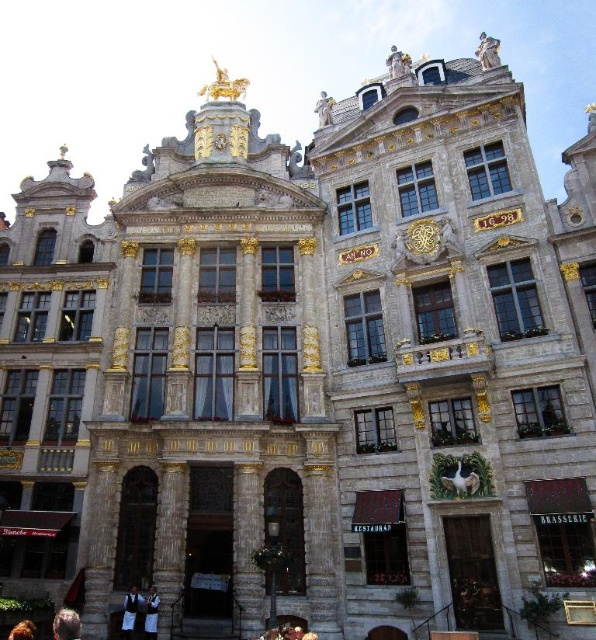
Is gold ornate clock at center closer to camera compared to brown leather jacket at lower left?

No, gold ornate clock at center is further to the viewer.

Who is lower down, gold ornate clock at center or brown leather jacket at lower left?

Positioned lower is brown leather jacket at lower left.

Which is behind, point (408, 232) or point (66, 632)?

The point (408, 232) is more distant.

Find the location of a particular element. The height and width of the screenshot is (640, 596). gold ornate clock at center is located at coordinates (423, 240).

Identify the location of brown leather jacket at lower left. (66, 625).

Can you confirm if brown leather jacket at lower left is shorter than blonde hair at lower left?

In fact, brown leather jacket at lower left may be taller than blonde hair at lower left.

Where is `brown leather jacket at lower left`? The height and width of the screenshot is (640, 596). brown leather jacket at lower left is located at coordinates (66, 625).

Measure the distance between gold ornate clock at center and camera.

gold ornate clock at center and camera are 55.17 meters apart.

Image resolution: width=596 pixels, height=640 pixels. What do you see at coordinates (423, 240) in the screenshot?
I see `gold ornate clock at center` at bounding box center [423, 240].

Image resolution: width=596 pixels, height=640 pixels. What do you see at coordinates (423, 240) in the screenshot?
I see `gold ornate clock at center` at bounding box center [423, 240].

Locate an element on the screen. The image size is (596, 640). gold ornate clock at center is located at coordinates (423, 240).